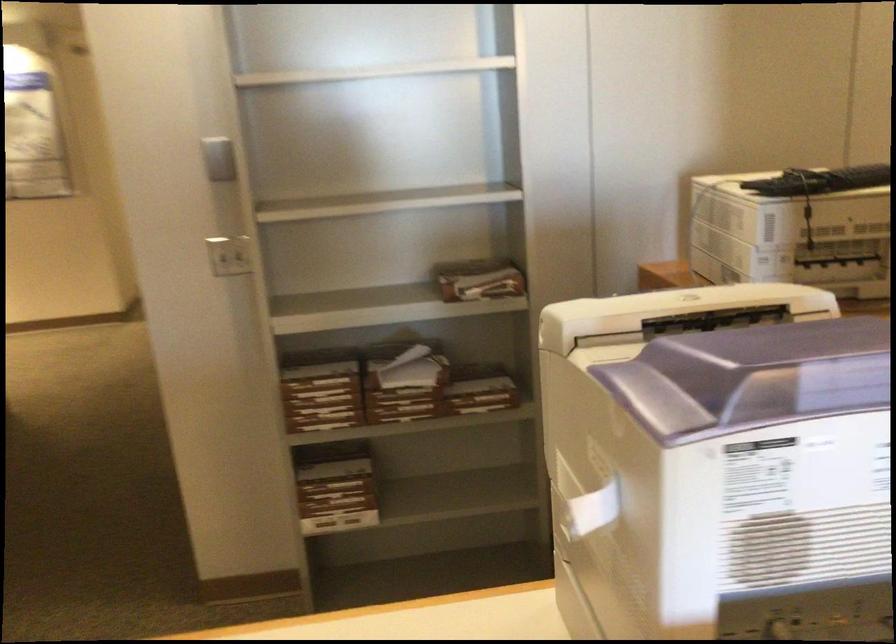
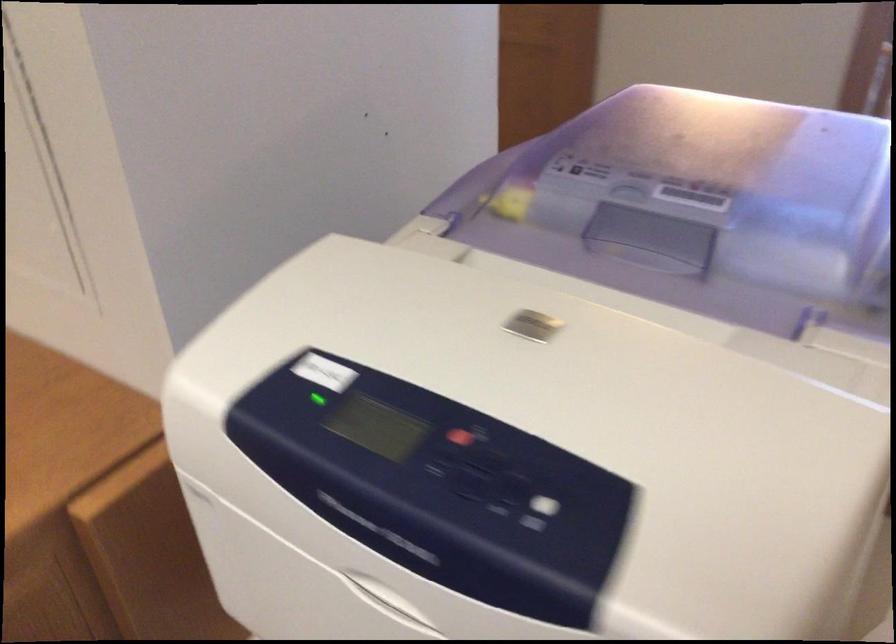
In the second image, find the point that corresponds to (702,307) in the first image.

(539, 325)